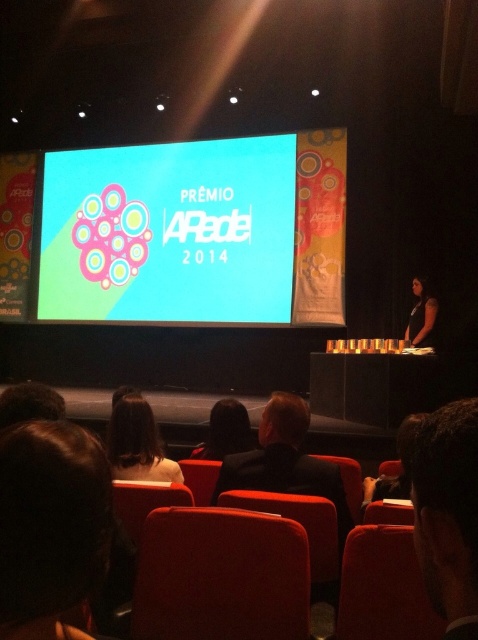
Looking at this image, is matte blue screen at center smaller than dark brown hair at upper right?

No.

Is matte blue screen at center shorter than dark brown hair at upper right?

No.

You are a GUI agent. You are given a task and a screenshot of the screen. Output one action in this format:
    pyautogui.click(x=<x>, y=<y>)
    Task: Click on the matte blue screen at center
    
    Given the screenshot: What is the action you would take?
    pyautogui.click(x=170, y=230)

Between dark brown hair at upper right and dark brown hair at lower center, which one appears on the left side from the viewer's perspective?

A: dark brown hair at upper right

The height and width of the screenshot is (640, 478). I want to click on dark brown hair at upper right, so click(447, 513).

The height and width of the screenshot is (640, 478). Identify the location of dark brown hair at upper right. (447, 513).

Looking at this image, does black suit at center have a lesser height compared to dark brown hair at lower center?

Yes.

Is black suit at center closer to the viewer compared to dark brown hair at lower center?

Yes, it is.

Locate an element on the screen. Image resolution: width=478 pixels, height=640 pixels. black suit at center is located at coordinates (285, 460).